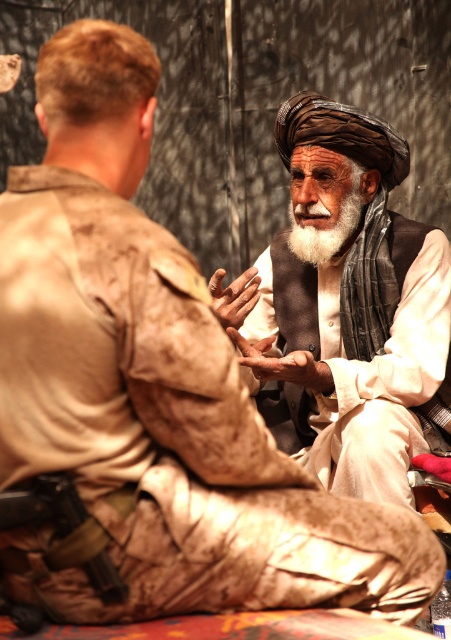
I want to click on camouflage uniform at right, so click(x=349, y=305).

Is camouflage uniform at right bigger than whitewoollybeard at center?

Correct, camouflage uniform at right is larger in size than whitewoollybeard at center.

Does point (275, 307) come closer to viewer compared to point (316, 248)?

That is False.

Where is `camouflage uniform at right`? This screenshot has width=451, height=640. camouflage uniform at right is located at coordinates (349, 305).

Can you confirm if camouflage uniform at right is bigger than brown woven turban at center?

Yes, camouflage uniform at right is bigger than brown woven turban at center.

Is point (335, 342) in front of point (348, 109)?

No.

Which is behind, point (348, 451) or point (357, 134)?

The point (357, 134) is behind.

Where is `camouflage uniform at right`? This screenshot has height=640, width=451. camouflage uniform at right is located at coordinates (349, 305).

Who is positioned more to the right, brown woven turban at center or whitewoollybeard at center?

Positioned to the right is brown woven turban at center.

I want to click on brown woven turban at center, so click(x=363, y=211).

Find the location of a particular element. brown woven turban at center is located at coordinates (x=363, y=211).